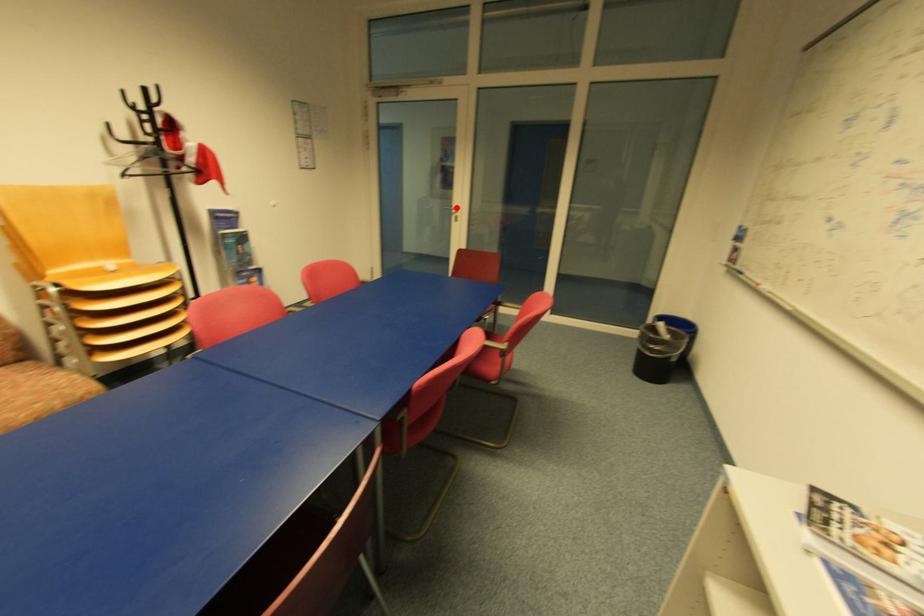
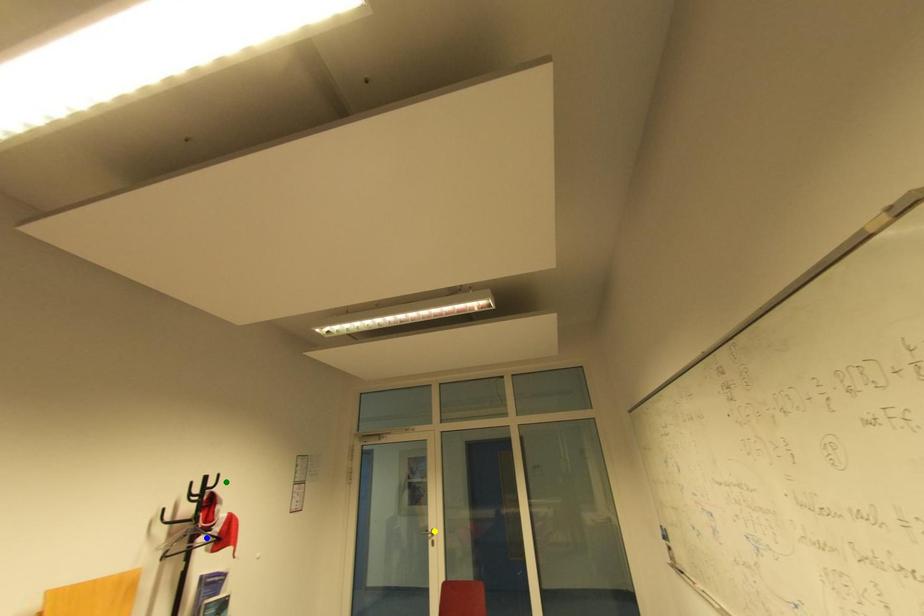
Question: I am providing you with two images of the same scene from different viewpoints. A red point is marked on the first image. You are given multiple points on the second image. Which mark in image 2 goes with the point in image 1?

Choices:
 (A) blue point
 (B) green point
 (C) yellow point

Answer: (C)